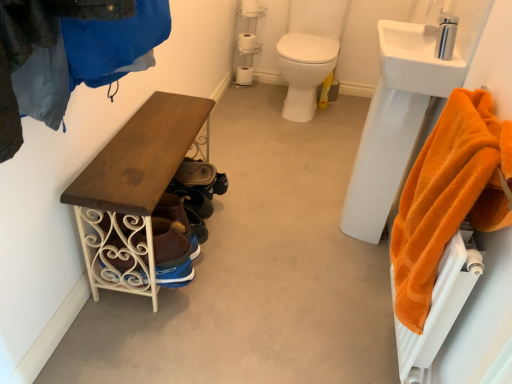
Find the location of a particular element. vacant point above wooden bench at left (from a real-world perspective) is located at coordinates (282, 213).